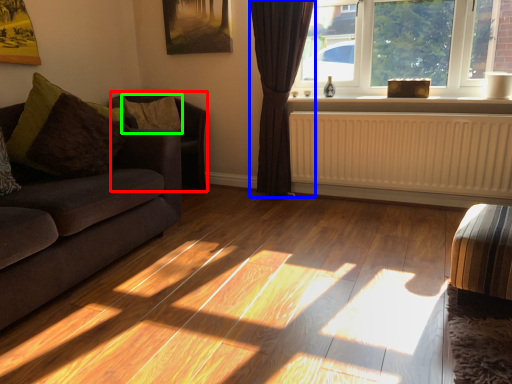
Question: Estimate the real-world distances between objects in this image. Which object is closer to armchair (highlighted by a red box), curtain (highlighted by a blue box) or pillow (highlighted by a green box)?

Choices:
 (A) curtain
 (B) pillow

Answer: (B)